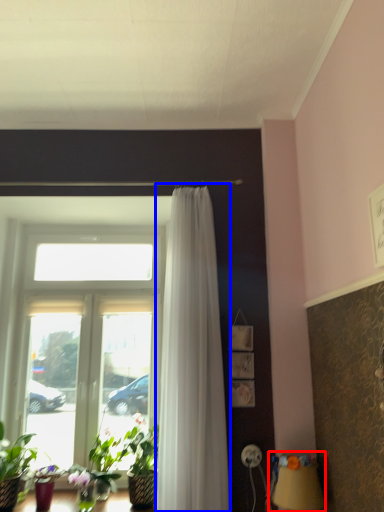
Question: Among these objects, which one is farthest to the camera, table lamp (highlighted by a red box) or curtain (highlighted by a blue box)?

Choices:
 (A) table lamp
 (B) curtain

Answer: (B)